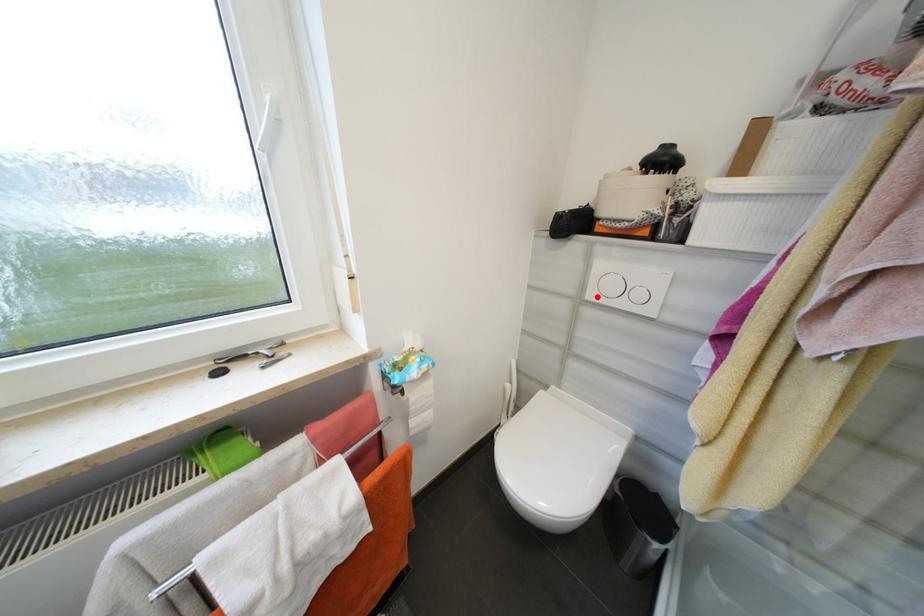
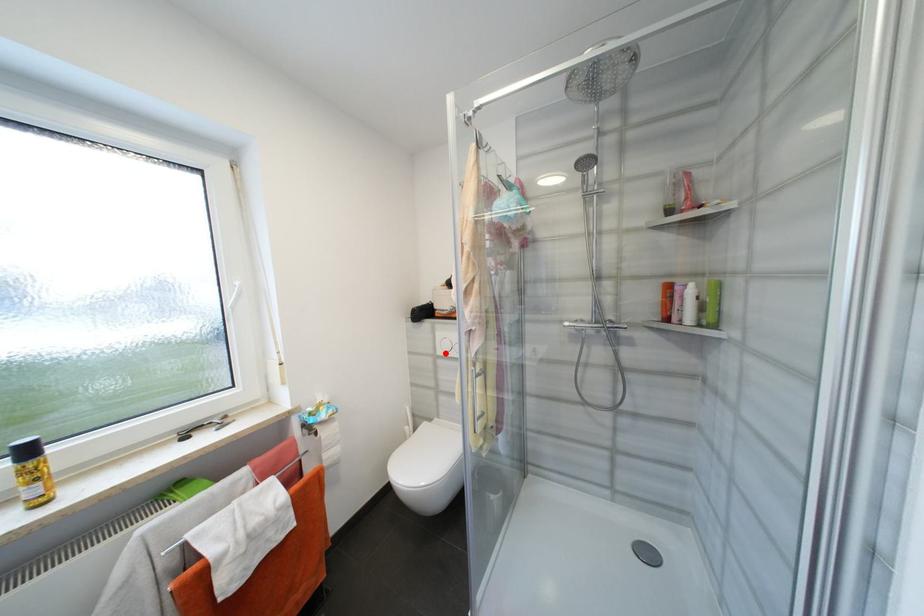
I am providing you with two images of the same scene from different viewpoints. A red point is marked on the first image and another point is marked on the second image. Are the points marked in image1 and image2 representing the same 3D position?

Yes